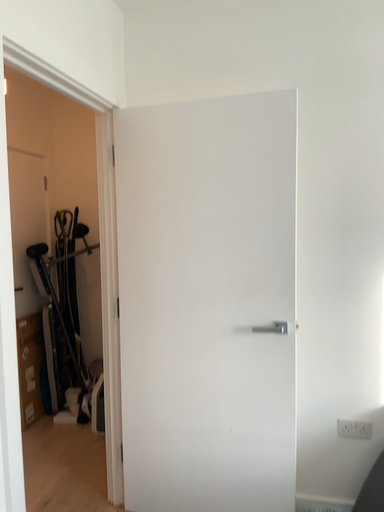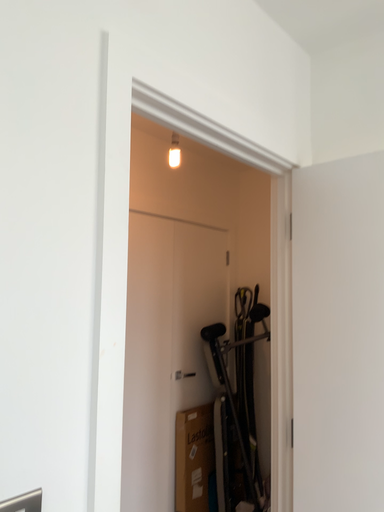
Question: How did the camera likely rotate when shooting the video?

Choices:
 (A) rotated left
 (B) rotated right

Answer: (A)